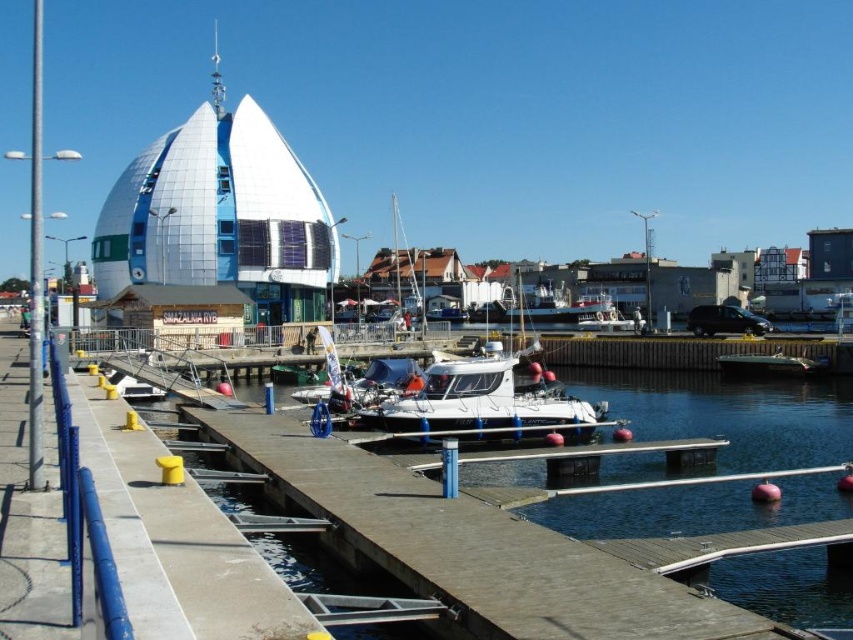
You are standing on the dock and want to take a photo of both the spherical building and the boats. You notice two points marked on your map at coordinates point (x=584, y=412) and point (x=821, y=371). Which point should you stand at to ensure both the spherical building and the boats are in focus without adjusting the camera settings?

You should stand at point (x=584, y=412) because it is closer to the camera, allowing both the spherical building and the boats to be in focus simultaneously.

You are a dock attendant who needs to park a new boat between the white matte boat at center and the white glossy boat at center. The new boat is 2 meters wide. Can you fit it between them if the space between the two boats is exactly 3 meters wide?

The white matte boat at center is wider than the white glossy boat at center. However, the space between them is 3 meters wide, which is greater than the new boat of 2 meters. Therefore, the new boat can fit between them.

What are the coordinates of the white matte boat at center?

The white matte boat at center is located at coordinates point (x=480, y=404).